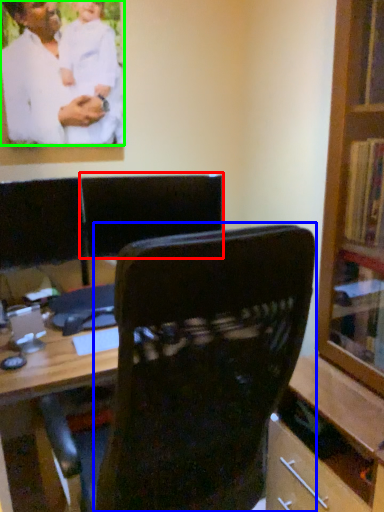
Question: Which object is the closest to the armchair (highlighted by a red box)? Choose among these: chair (highlighted by a blue box) or man (highlighted by a green box).

Choices:
 (A) chair
 (B) man

Answer: (B)